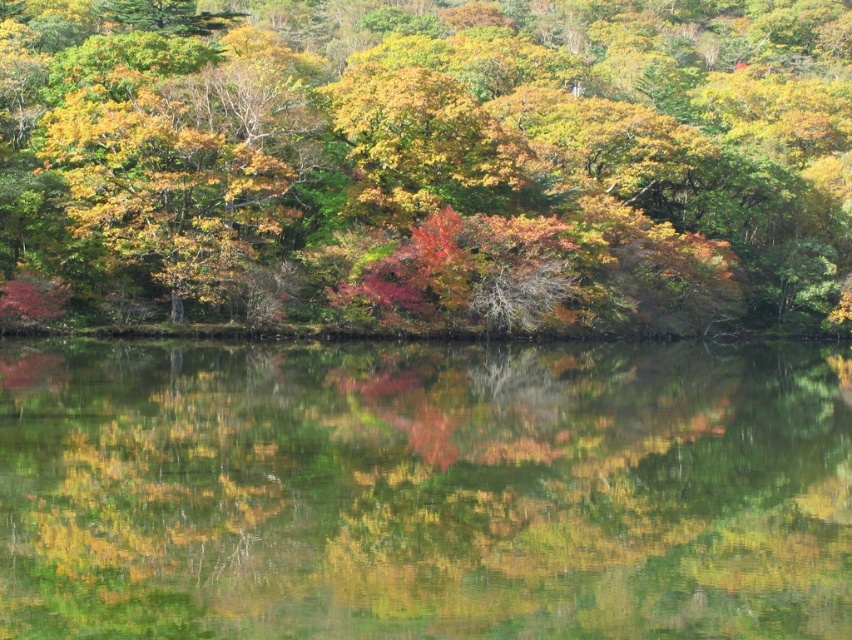
Question: Among these objects, which one is nearest to the camera?

Choices:
 (A) shiny green leaves at center
 (B) green reflective water at center

Answer: (B)

Question: Which of the following is the closest to the observer?

Choices:
 (A) green reflective water at center
 (B) shiny green leaves at center

Answer: (A)

Question: Which of the following is the farthest from the observer?

Choices:
 (A) green reflective water at center
 (B) shiny green leaves at center

Answer: (B)

Question: Does shiny green leaves at center have a smaller size compared to green reflective water at center?

Choices:
 (A) yes
 (B) no

Answer: (B)

Question: Can you confirm if shiny green leaves at center is positioned to the right of green reflective water at center?

Choices:
 (A) no
 (B) yes

Answer: (B)

Question: Can you confirm if shiny green leaves at center is positioned above green reflective water at center?

Choices:
 (A) no
 (B) yes

Answer: (B)